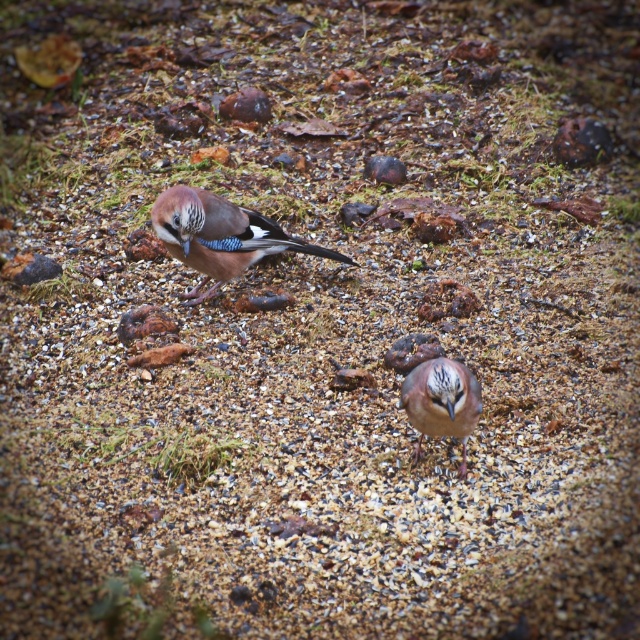
You are a birdwatcher observing two Eurasian jays in a damp environment. You notice a point marked at coordinates (220, 236). Which bird is located at that point?

The point at (220, 236) indicates the matte brown bird at center.

You are a birdwatcher observing the matte brown bird at center and the brown speckled feathers at center in the image. Which object is positioned higher in the scene?

The matte brown bird at center is located above the brown speckled feathers at center, so it is positioned higher in the scene.

In the scene shown: You are a photographer aiming to capture the matte brown bird at center in your shot. Your camera has a focus point at coordinates 0.370, 0.345. Will this focus point align with the bird?

Yes, the matte brown bird at center is located exactly at the coordinates (220,236), so the focus point will align perfectly with the bird.